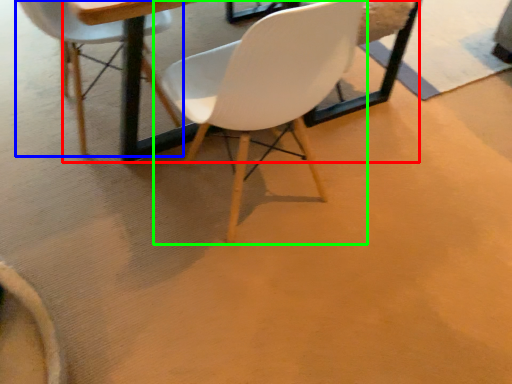
Question: Which object is positioned closest to round table (highlighted by a red box)? Select from chair (highlighted by a blue box) and chair (highlighted by a green box).

Choices:
 (A) chair
 (B) chair

Answer: (A)